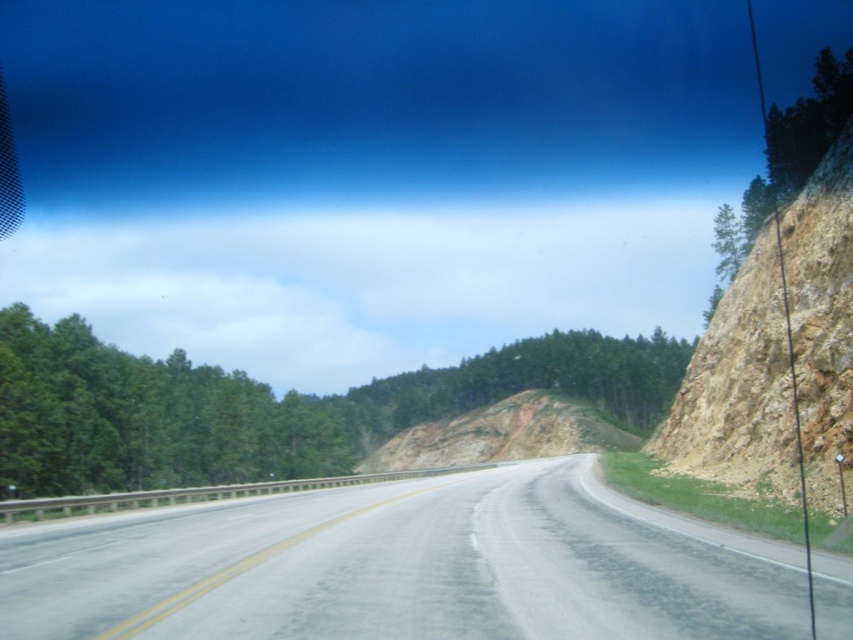
You are driving along the two lane road and see the brown rocky hillside at right and the brown dirt hillside at center. Which one is located to the right of the other?

The brown rocky hillside at right is located to the right of the brown dirt hillside at center.

You are a surveyor tasked with assessing the stability of the brown rocky hillside at right. Based on its position relative to the road, what direction would you prioritize for safety inspections?

The brown rocky hillside at right is located at point (x=738, y=390), which is on the right side of the road. Safety inspections should prioritize the right side due to the unstable rocky terrain and potential for erosion or landslides.

A car is driving along the two lane road in the image. The car is currently at point (840,364). The driver wants to know if they can safely stop before reaching the steep rocky hillside on the right. The car can brake at a maximum deceleration of 8 m per second squared. What is the minimum speed the car must be traveling at to ensure it can stop before hitting the hillside?

The car is 23.54 meters away from the steep rocky hillside. Using the braking formula v squared equals 2 a d, where a is 8 m per second squared and d is 23.54 meters, the minimum speed required is sqrt 2 times 8 times 23.54 equals sqrt 376.64 equals approximately 19.41 meters per second, which converts to about 69.88 kilometers per hour. Therefore, the car must be traveling at least 69.88 km per hour to safely stop before the hillside.